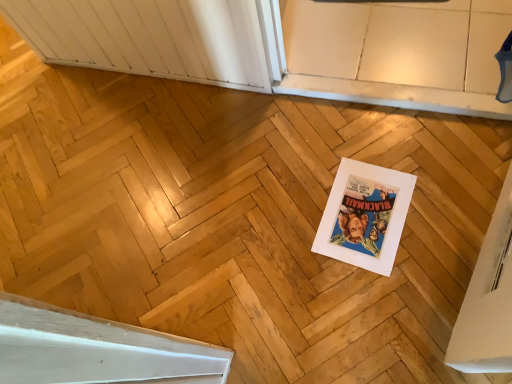
What are the coordinates of `vacant area that is situated to the right of white paper comic book at center` in the screenshot? It's located at (438, 185).